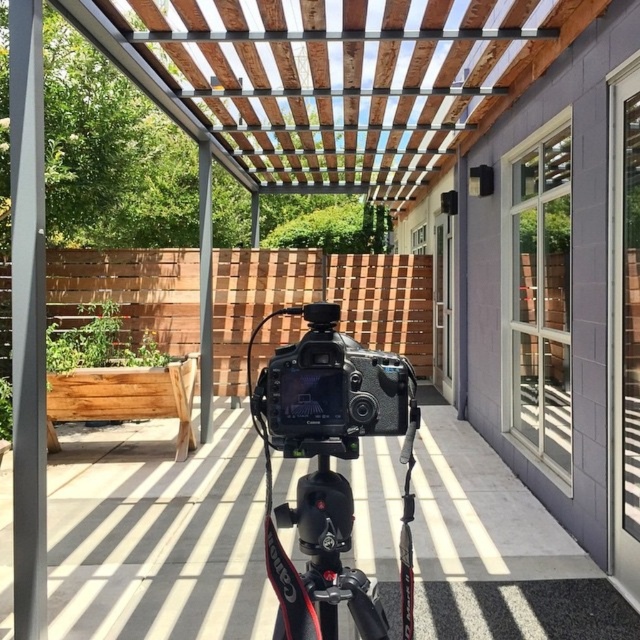
You are a photographer trying to adjust the distance between your matte black camera at center and the Canon DSLR camera mounted on a tripod. According to the scene, how far apart are they?

The matte black camera at center and the Canon DSLR camera mounted on a tripod are 8.32 feet apart from each other.

You are setting up a camera for a time lapse and need to ensure the matte black camera at center and the smooth gray pole at left are both in frame. Which object should you place closer to the left side of your camera frame?

The smooth gray pole at left should be placed closer to the left side of the camera frame since the matte black camera at center is positioned on the right side of it.